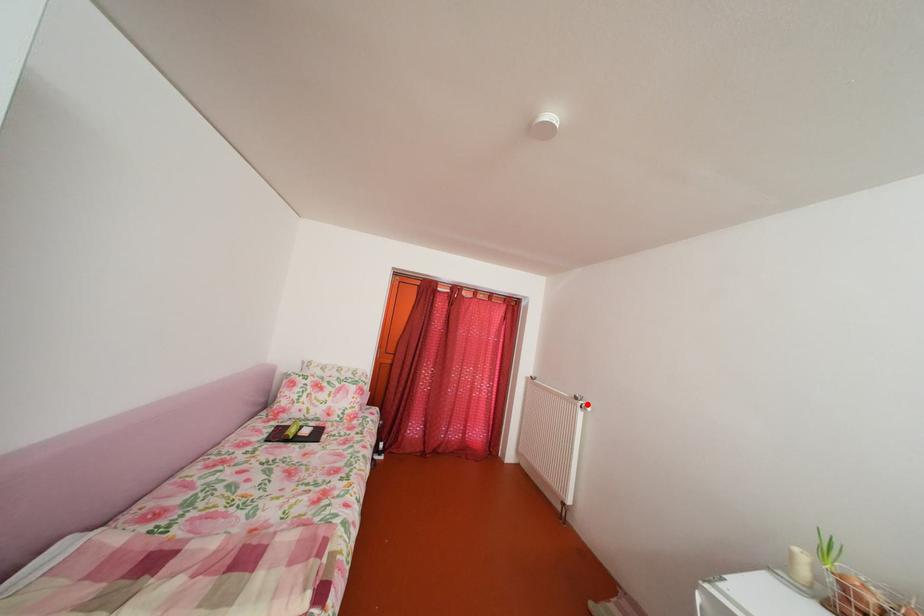
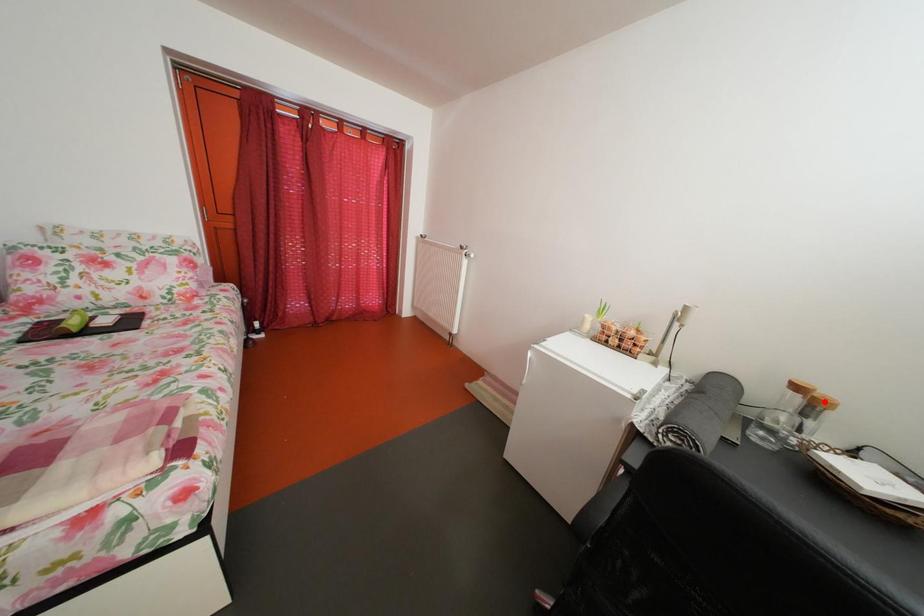
In the scene shown: I am providing you with two images of the same scene from different viewpoints. A red point is marked on the first image and another point is marked on the second image. Is the red point in image1 aligned with the point shown in image2?

No